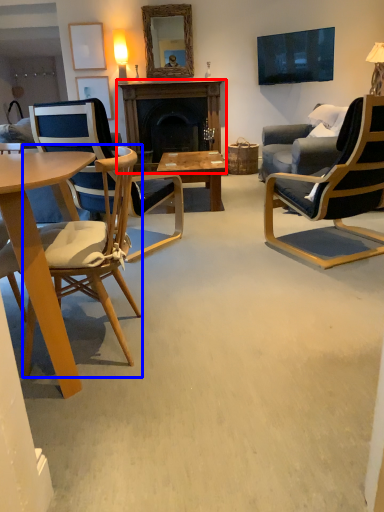
Question: Which of the following is the closest to the observer, fireplace (highlighted by a red box) or chair (highlighted by a blue box)?

Choices:
 (A) fireplace
 (B) chair

Answer: (B)